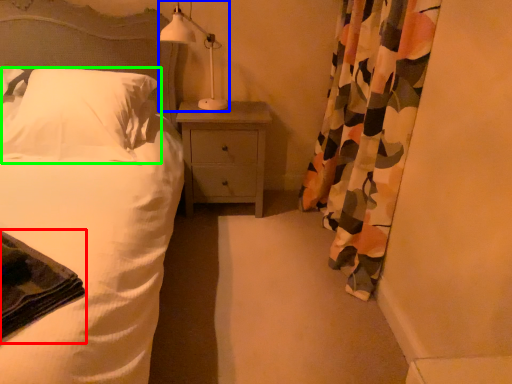
Question: Which is farther away from material (highlighted by a red box)? table lamp (highlighted by a blue box) or pillow (highlighted by a green box)?

Choices:
 (A) table lamp
 (B) pillow

Answer: (A)